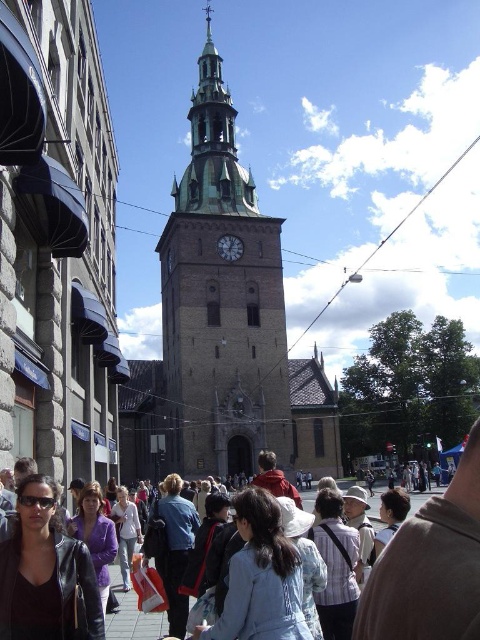
Identify the location of matte black jacket at lower left. Image resolution: width=480 pixels, height=640 pixels. (431, 566).

Who is higher up, matte black jacket at lower left or matte gray clock at center?

matte gray clock at center

What are the coordinates of `matte black jacket at lower left` in the screenshot? It's located at (431, 566).

Does dark brown stone church at center appear over brown stone church at center?

Actually, dark brown stone church at center is below brown stone church at center.

Does point (111, 394) lie behind point (154, 376)?

No, (111, 394) is in front of (154, 376).

Is point (11, 35) positioned behind point (153, 468)?

No, it is not.

This screenshot has height=640, width=480. Identify the location of dark brown stone church at center. (57, 244).

Who is taller, brown stone church at center or matte gray clock at center?

Standing taller between the two is brown stone church at center.

Can you confirm if brown stone church at center is smaller than matte gray clock at center?

No.

Image resolution: width=480 pixels, height=640 pixels. I want to click on brown stone church at center, so click(223, 326).

At what (x,y) coordinates should I click in order to perform the action: click on brown stone church at center. Please return your answer as a coordinate pair (x, y). Image resolution: width=480 pixels, height=640 pixels. Looking at the image, I should click on (223, 326).